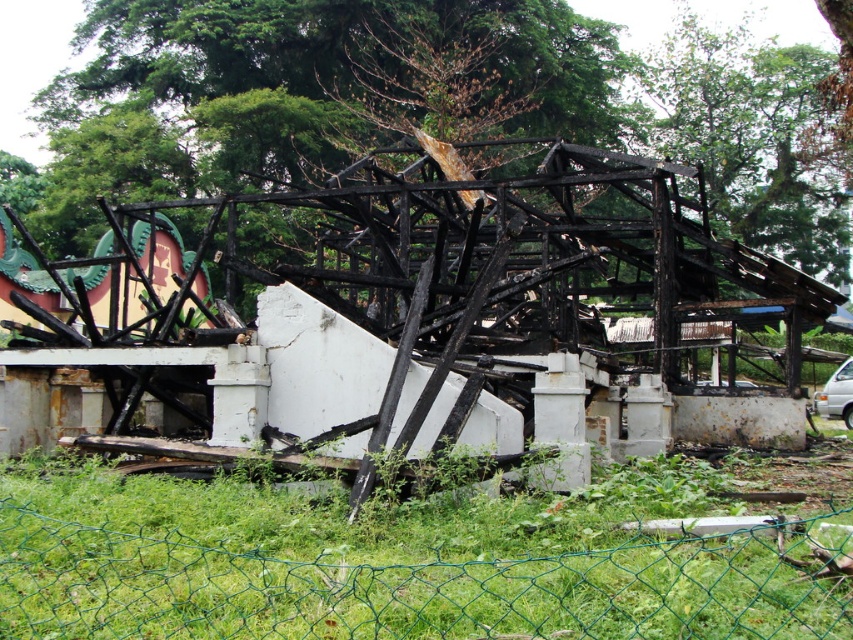
Is brown wood tree at upper center to the left of green wire mesh fence at lower center from the viewer's perspective?

In fact, brown wood tree at upper center is to the right of green wire mesh fence at lower center.

From the picture: Who is positioned more to the right, brown wood tree at upper center or green wire mesh fence at lower center?

Positioned to the right is brown wood tree at upper center.

I want to click on brown wood tree at upper center, so click(x=184, y=104).